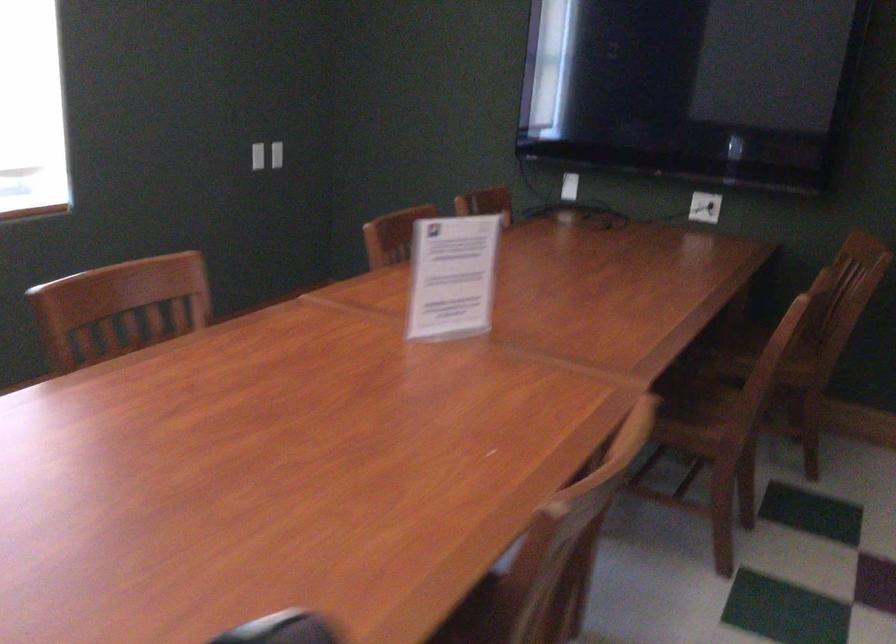
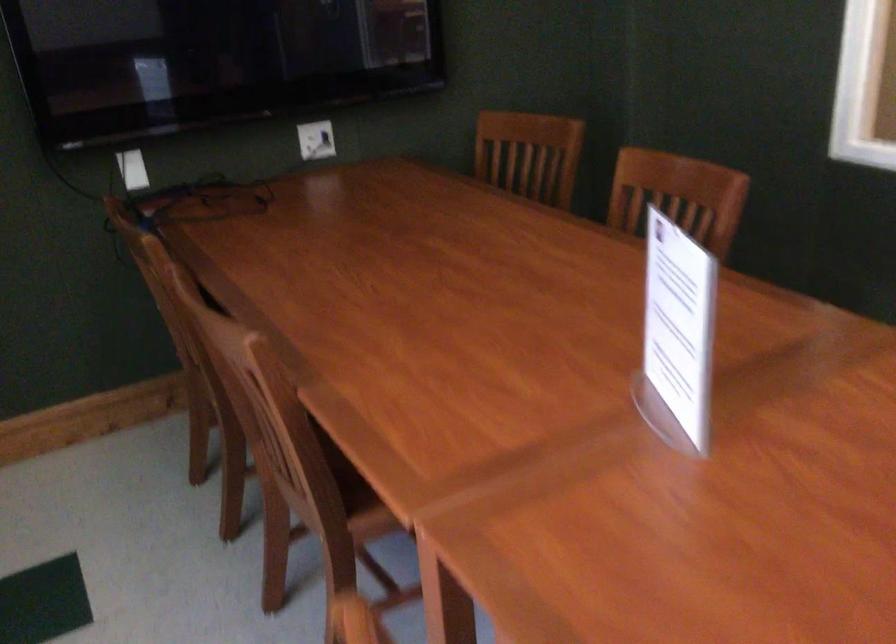
Find the pixel in the second image that matches the point at 378,281 in the first image.

(299, 413)